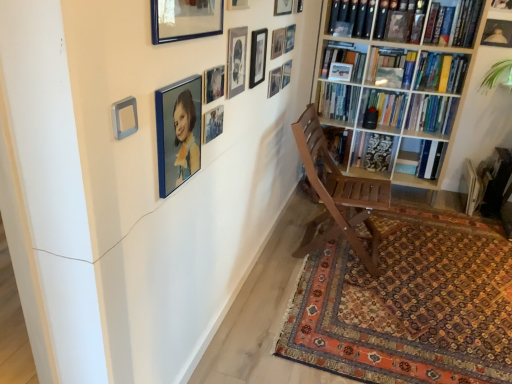
What is the approximate height of hardcover book at upper right, arranged as the 1th book when viewed from the top?

12.09 inches.

Find the location of a particular element. matte black picture frame at upper center, acting as the eighth picture frame starting from the right is located at coordinates coord(258,57).

What do you see at coordinates (275, 81) in the screenshot? The height and width of the screenshot is (384, 512). I see `matte black picture frame at upper center, marked as the 7th picture frame in a right-to-left arrangement` at bounding box center [275, 81].

The width and height of the screenshot is (512, 384). I want to click on matte black picture frame at upper center, marked as the eighth picture frame in a left-to-right arrangement, so click(275, 81).

Where is `matte gold picture frame at upper right, the fourteenth picture frame from the left`? This screenshot has width=512, height=384. matte gold picture frame at upper right, the fourteenth picture frame from the left is located at coordinates (497, 33).

The width and height of the screenshot is (512, 384). Describe the element at coordinates (283, 7) in the screenshot. I see `matte black picture frame at upper center, which ranks as the fifth picture frame in right-to-left order` at that location.

What are the coordinates of `wooden bookcase at right` in the screenshot? It's located at (398, 81).

Considering the sizes of objects matte black picture frame at upper center, which is the tenth picture frame in right-to-left order, and metallic silver picture frame at upper center, the 4th picture frame when ordered from right to left, in the image provided, who is wider, matte black picture frame at upper center, which is the tenth picture frame in right-to-left order, or metallic silver picture frame at upper center, the 4th picture frame when ordered from right to left,?

metallic silver picture frame at upper center, the 4th picture frame when ordered from right to left.

Measure the distance between matte black picture frame at upper center, which is the tenth picture frame in right-to-left order, and metallic silver picture frame at upper center, the eleventh picture frame when ordered from left to right.

29.17 inches.

How many degrees apart are the facing directions of matte black picture frame at upper center, which is the tenth picture frame in right-to-left order, and metallic silver picture frame at upper center, the eleventh picture frame when ordered from left to right?

matte black picture frame at upper center, which is the tenth picture frame in right-to-left order, and metallic silver picture frame at upper center, the eleventh picture frame when ordered from left to right, are facing 0.0269 degrees away from each other.

Which object is positioned more to the left, matte black picture frame at upper center, which is the tenth picture frame in right-to-left order, or metallic silver picture frame at upper center, the 4th picture frame when ordered from right to left?

matte black picture frame at upper center, which is the tenth picture frame in right-to-left order, is more to the left.

From the image's perspective, is hardcover book at upper right, which is the 3th book in top-to-bottom order, positioned above or below metallic silver picture frame at upper center, positioned as the 3th picture frame in left-to-right order?

Based on their image positions, hardcover book at upper right, which is the 3th book in top-to-bottom order, is located above metallic silver picture frame at upper center, positioned as the 3th picture frame in left-to-right order.

From a real-world perspective, starting from the metallic silver picture frame at upper center, which appears as the 12th picture frame when viewed from the right, which book is the 2nd one below it? Please provide its 2D coordinates.

[(431, 113)]

In the scene shown: Which of these two, hardcover book at upper right, which appears as the 2th book when ordered from the bottom, or metallic silver picture frame at upper center, positioned as the 3th picture frame in left-to-right order, stands taller?

hardcover book at upper right, which appears as the 2th book when ordered from the bottom, is taller.

Looking at this image, is hardcover book at upper right, which appears as the 2th book when ordered from the bottom, facing towards metallic silver picture frame at upper center, positioned as the 3th picture frame in left-to-right order?

Yes, hardcover book at upper right, which appears as the 2th book when ordered from the bottom, is oriented towards metallic silver picture frame at upper center, positioned as the 3th picture frame in left-to-right order.

In the scene shown: Is matte black picture frame at upper center, the fifth picture frame positioned from the left, beside carpeted rug at lower right?

matte black picture frame at upper center, the fifth picture frame positioned from the left, and carpeted rug at lower right are not in contact.

Measure the distance from matte black picture frame at upper center, which is the tenth picture frame in right-to-left order, to carpeted rug at lower right.

matte black picture frame at upper center, which is the tenth picture frame in right-to-left order, is 4.70 feet from carpeted rug at lower right.

Is matte black picture frame at upper center, which is the tenth picture frame in right-to-left order, at the right side of carpeted rug at lower right?

No, matte black picture frame at upper center, which is the tenth picture frame in right-to-left order, is not to the right of carpeted rug at lower right.

Which point is more distant from viewer, (244, 38) or (453, 233)?

The point (453, 233) is more distant.

Can you tell me how much wooden folding chair at lower right, positioned as the 1th book in bottom-to-top order, and metallic silver picture frame at upper center, the 4th picture frame when ordered from right to left, differ in facing direction?

The facing directions of wooden folding chair at lower right, positioned as the 1th book in bottom-to-top order, and metallic silver picture frame at upper center, the 4th picture frame when ordered from right to left, are 90.6 degrees apart.

From the image's perspective, which one is positioned higher, wooden folding chair at lower right, positioned as the 1th book in bottom-to-top order, or metallic silver picture frame at upper center, the 4th picture frame when ordered from right to left?

metallic silver picture frame at upper center, the 4th picture frame when ordered from right to left, is shown above in the image.

The width and height of the screenshot is (512, 384). In order to click on picture frame that is the 8th object located above the wooden folding chair at lower right, the 4th book when ordered from top to bottom (from the image's perspective) in this screenshot , I will do `click(286, 73)`.

From the picture: Can metallic silver picture frame at upper center, the eleventh picture frame when ordered from left to right, be found inside wooden folding chair at lower right, positioned as the 1th book in bottom-to-top order?

No, metallic silver picture frame at upper center, the eleventh picture frame when ordered from left to right, is not inside wooden folding chair at lower right, positioned as the 1th book in bottom-to-top order.

Who is taller, matte black picture frame at upper center, which is the tenth picture frame in right-to-left order, or hardcover book at upper right, which ranks as the 2th book in top-to-bottom order?

Standing taller between the two is hardcover book at upper right, which ranks as the 2th book in top-to-bottom order.

In the scene shown: Is matte black picture frame at upper center, which is the tenth picture frame in right-to-left order, next to hardcover book at upper right, which ranks as the 2th book in top-to-bottom order, and touching it?

They are not placed beside each other.

In the image, is matte black picture frame at upper center, the fifth picture frame positioned from the left, positioned in front of or behind hardcover book at upper right, which ranks as the 2th book in top-to-bottom order?

Visually, matte black picture frame at upper center, the fifth picture frame positioned from the left, is located in front of hardcover book at upper right, which ranks as the 2th book in top-to-bottom order.

Can you confirm if matte black picture frame at upper center, which is the tenth picture frame in right-to-left order, is smaller than hardcover book at upper right, which ranks as the 2th book in top-to-bottom order?

Correct, matte black picture frame at upper center, which is the tenth picture frame in right-to-left order, occupies less space than hardcover book at upper right, which ranks as the 2th book in top-to-bottom order.

Considering their positions, is metallic silver picture frame at upper center, positioned as the 3th picture frame in left-to-right order, located in front of or behind matte black picture frame at upper center, which ranks as the 9th picture frame in right-to-left order?

In the image, metallic silver picture frame at upper center, positioned as the 3th picture frame in left-to-right order, appears behind matte black picture frame at upper center, which ranks as the 9th picture frame in right-to-left order.

How many degrees apart are the facing directions of metallic silver picture frame at upper center, positioned as the 3th picture frame in left-to-right order, and matte black picture frame at upper center, which is the sixth picture frame from left to right?

The angular difference between metallic silver picture frame at upper center, positioned as the 3th picture frame in left-to-right order, and matte black picture frame at upper center, which is the sixth picture frame from left to right, is 0.0544 degrees.

Does metallic silver picture frame at upper center, positioned as the 3th picture frame in left-to-right order, have a lesser width compared to matte black picture frame at upper center, which is the sixth picture frame from left to right?

Indeed, metallic silver picture frame at upper center, positioned as the 3th picture frame in left-to-right order, has a lesser width compared to matte black picture frame at upper center, which is the sixth picture frame from left to right.

Is metallic silver picture frame at upper center, which appears as the 12th picture frame when viewed from the right, facing away from matte black picture frame at upper center, which ranks as the 9th picture frame in right-to-left order?

No, metallic silver picture frame at upper center, which appears as the 12th picture frame when viewed from the right, is not facing away from matte black picture frame at upper center, which ranks as the 9th picture frame in right-to-left order.

From a real-world perspective, between wooden bookcase at right and blue glossy picture frame at upper center, acting as the 14th picture frame starting from the right, who is vertically higher?

In real-world perspective, blue glossy picture frame at upper center, acting as the 14th picture frame starting from the right, is above.

Which object is thinner, wooden bookcase at right or blue glossy picture frame at upper center, positioned as the 1th picture frame in left-to-right order?

Thinner between the two is blue glossy picture frame at upper center, positioned as the 1th picture frame in left-to-right order.

Is wooden bookcase at right in contact with blue glossy picture frame at upper center, positioned as the 1th picture frame in left-to-right order?

No, wooden bookcase at right is not with blue glossy picture frame at upper center, positioned as the 1th picture frame in left-to-right order.

Between point (448, 24) and point (177, 176), which one is positioned in front?

The point (177, 176) is in front.

This screenshot has height=384, width=512. What are the coordinates of `the 4th picture frame above the matte black picture frame at upper center, which is the tenth picture frame in right-to-left order (from the image's perspective)` in the screenshot? It's located at (286, 73).

Identify the location of the 2nd book below the metallic silver picture frame at upper center, positioned as the 3th picture frame in left-to-right order (from a real-world perspective). (431, 113).

Considering their positions, is wooden folding chair at lower right, positioned as the 1th book in bottom-to-top order, positioned closer to hardcover book at upper right, placed as the 3th book when sorted from bottom to top, than matte black picture frame at upper center, marked as the eighth picture frame in a left-to-right arrangement?

wooden folding chair at lower right, positioned as the 1th book in bottom-to-top order, is closer to hardcover book at upper right, placed as the 3th book when sorted from bottom to top.

When comparing their distances from wooden folding chair at lower right, the 4th book when ordered from top to bottom, does blue glossy picture frame at upper center, positioned as the 1th picture frame in left-to-right order, or matte black picture frame at upper center, marked as the eighth picture frame in a left-to-right arrangement, seem further?

Among the two, blue glossy picture frame at upper center, positioned as the 1th picture frame in left-to-right order, is located further to wooden folding chair at lower right, the 4th book when ordered from top to bottom.

Which object lies further to the anchor point hardcover book at upper right, which is the 3th book in top-to-bottom order, matte black picture frame at upper center, which is the tenth picture frame in right-to-left order, or matte black picture frame at upper center, placed as the seventh picture frame when sorted from left to right?

matte black picture frame at upper center, which is the tenth picture frame in right-to-left order, is positioned further to the anchor hardcover book at upper right, which is the 3th book in top-to-bottom order.

Considering their positions, is matte gold picture frame at upper right, the 1th picture frame in the right-to-left sequence, positioned further to matte black picture frame at upper center, which ranks as the 9th picture frame in right-to-left order, than hardcover book at upper right, which is the 3th book in top-to-bottom order?

matte gold picture frame at upper right, the 1th picture frame in the right-to-left sequence.

When comparing their distances from blue glossy picture frame at upper center, acting as the 14th picture frame starting from the right, does matte black picture frame at upper center, placed as the seventh picture frame when sorted from left to right, or metallic silver picture frame at upper center, positioned as the 3th picture frame in left-to-right order, seem further?

matte black picture frame at upper center, placed as the seventh picture frame when sorted from left to right, is further to blue glossy picture frame at upper center, acting as the 14th picture frame starting from the right.

From the image, which object appears to be farther from metallic silver picture frame at upper center, placed as the fourth picture frame when sorted from left to right, wooden folding chair at lower right, the 4th book when ordered from top to bottom, or blue glossy picture frame at upper center, the thirteenth picture frame from the right?

The object further to metallic silver picture frame at upper center, placed as the fourth picture frame when sorted from left to right, is wooden folding chair at lower right, the 4th book when ordered from top to bottom.

Which object lies further to the anchor point blue glossy picture frame at upper center, positioned as the 1th picture frame in left-to-right order, wooden folding chair at lower right, positioned as the 1th book in bottom-to-top order, or hardcover book at upper right, placed as the 3th book when sorted from bottom to top?

The object further to blue glossy picture frame at upper center, positioned as the 1th picture frame in left-to-right order, is wooden folding chair at lower right, positioned as the 1th book in bottom-to-top order.

Based on their spatial positions, is carpeted rug at lower right or blue glossy picture frame at upper center, acting as the 2th picture frame starting from the left, further from hardcover book at upper right, placed as the 3th book when sorted from bottom to top?

The object further to hardcover book at upper right, placed as the 3th book when sorted from bottom to top, is blue glossy picture frame at upper center, acting as the 2th picture frame starting from the left.

You are a GUI agent. You are given a task and a screenshot of the screen. Output one action in this format:
    pyautogui.click(x=<x>, y=<y>)
    Task: Click on the bookcase located between metallic silver picture frame at upper center, the 4th picture frame when ordered from right to left, and hardcover book at upper right, which appears as the 2th book when ordered from the bottom, in the left-right direction
    This screenshot has height=384, width=512.
    Given the screenshot: What is the action you would take?
    pyautogui.click(x=398, y=81)

Where is `chair between matte black picture frame at upper center, the 6th picture frame viewed from the right, and wooden folding chair at lower right, the 4th book when ordered from top to bottom, from left to right`? The width and height of the screenshot is (512, 384). chair between matte black picture frame at upper center, the 6th picture frame viewed from the right, and wooden folding chair at lower right, the 4th book when ordered from top to bottom, from left to right is located at coordinates (337, 194).

The image size is (512, 384). In order to click on book between metallic silver picture frame at upper center, arranged as the 13th picture frame when viewed from the left, and hardcover book at upper right, which is the 3th book in top-to-bottom order, from left to right in this screenshot , I will do `click(441, 72)`.

The height and width of the screenshot is (384, 512). I want to click on bookcase between matte black picture frame at upper center, marked as the eighth picture frame in a left-to-right arrangement, and wooden folding chair at lower right, positioned as the 1th book in bottom-to-top order, from left to right, so click(x=398, y=81).